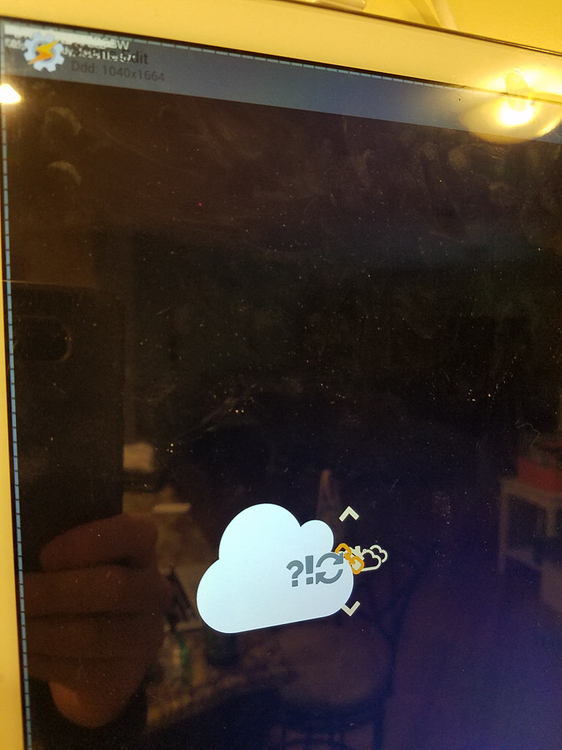
Find the location of a particular element. The width and height of the screenshot is (562, 750). reflection of white table is located at coordinates (541, 499).